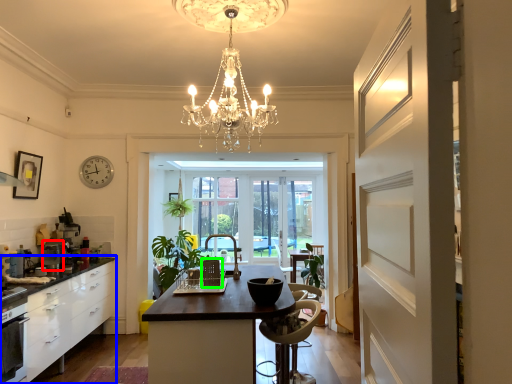
Question: Which is farther away from appliance (highlighted by a red box)? cabinetry (highlighted by a blue box) or chair (highlighted by a green box)?

Choices:
 (A) cabinetry
 (B) chair

Answer: (B)